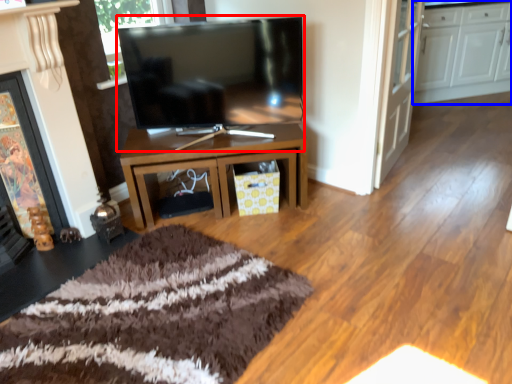
Question: Which object is closer to the camera taking this photo, television (highlighted by a red box) or cabinetry (highlighted by a blue box)?

Choices:
 (A) television
 (B) cabinetry

Answer: (A)